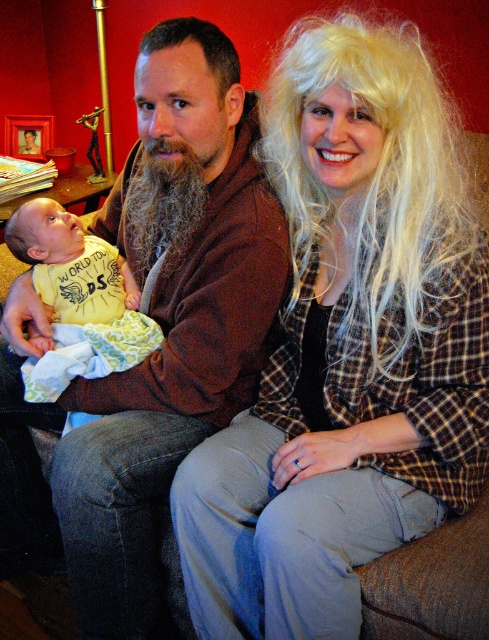
The image size is (489, 640). What do you see at coordinates (350, 344) in the screenshot? I see `blonde hair at center` at bounding box center [350, 344].

Who is higher up, blonde hair at center or brown soft sweater at center?

blonde hair at center is higher up.

Which is in front, point (270, 572) or point (174, 38)?

Point (270, 572) is more forward.

At what (x,y) coordinates should I click in order to perform the action: click on blonde hair at center. Please return your answer as a coordinate pair (x, y). This screenshot has width=489, height=640. Looking at the image, I should click on point(350,344).

Between brown soft sweater at center and yellow cotton bib at center, which one has more height?

Standing taller between the two is brown soft sweater at center.

Is point (130, 406) more distant than point (79, 292)?

No, it is not.

This screenshot has width=489, height=640. Describe the element at coordinates (171, 317) in the screenshot. I see `brown soft sweater at center` at that location.

Locate an element on the screen. The height and width of the screenshot is (640, 489). brown soft sweater at center is located at coordinates (171, 317).

Who is positioned more to the left, blonde hair at center or yellow cotton bib at center?

yellow cotton bib at center is more to the left.

Is point (341, 157) positioned behind point (143, 324)?

That is False.

Is point (297, 131) more distant than point (58, 289)?

No, it is in front of (58, 289).

Locate an element on the screen. The height and width of the screenshot is (640, 489). blonde hair at center is located at coordinates pos(350,344).